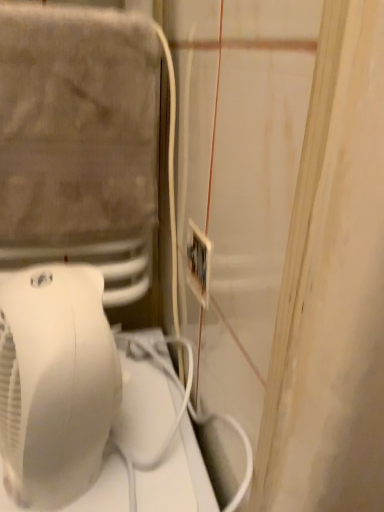
Question: Visually, is white plastic electric outlet at center positioned to the left or to the right of white plastic fan at left?

Choices:
 (A) left
 (B) right

Answer: (B)

Question: Looking at the image, does white plastic electric outlet at center seem bigger or smaller compared to white plastic fan at left?

Choices:
 (A) big
 (B) small

Answer: (B)

Question: From the image's perspective, relative to white plastic fan at left, is white plastic electric outlet at center above or below?

Choices:
 (A) below
 (B) above

Answer: (B)

Question: From the image's perspective, is white plastic fan at left located above or below white plastic electric outlet at center?

Choices:
 (A) above
 (B) below

Answer: (B)

Question: From a real-world perspective, relative to white plastic electric outlet at center, is white plastic fan at left vertically above or below?

Choices:
 (A) above
 (B) below

Answer: (B)

Question: In terms of size, does white plastic fan at left appear bigger or smaller than white plastic electric outlet at center?

Choices:
 (A) small
 (B) big

Answer: (B)

Question: Visually, is white plastic fan at left positioned to the left or to the right of white plastic electric outlet at center?

Choices:
 (A) right
 (B) left

Answer: (B)